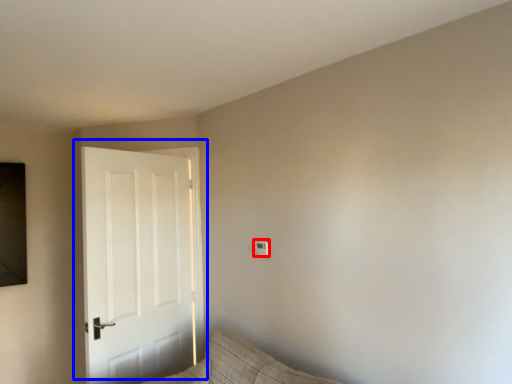
Question: Which of the following is the closest to the observer, light switch (highlighted by a red box) or door (highlighted by a blue box)?

Choices:
 (A) light switch
 (B) door

Answer: (B)